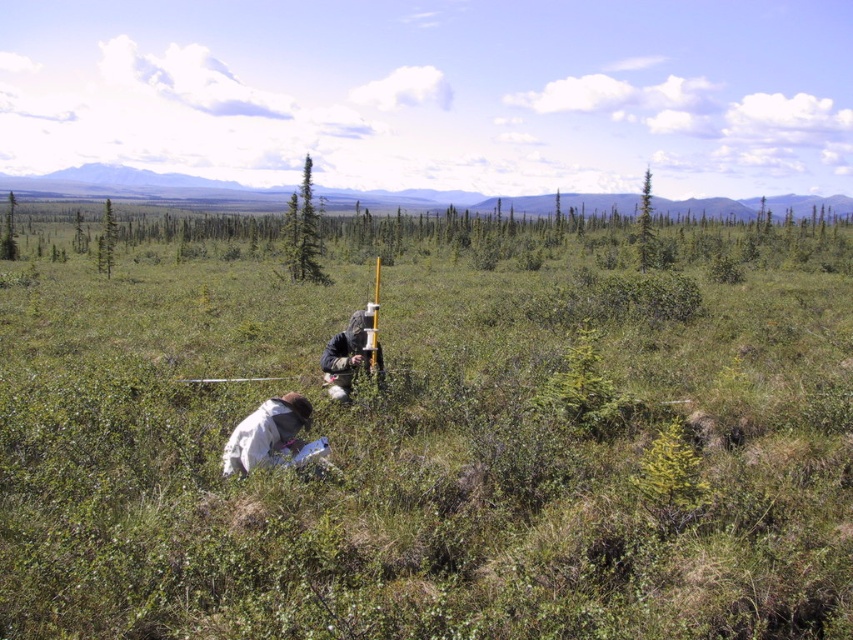
Question: Can you confirm if green grass at center is smaller than green matte tree at center?

Choices:
 (A) yes
 (B) no

Answer: (B)

Question: Which point is closer to the camera taking this photo?

Choices:
 (A) (648, 172)
 (B) (277, 410)
 (C) (111, 212)
 (D) (384, 445)

Answer: (B)

Question: From the image, what is the correct spatial relationship of white fabric at lower left in relation to green matte tree at center?

Choices:
 (A) above
 (B) below

Answer: (B)

Question: Can you confirm if white fabric at center is smaller than green coniferous tree at upper left?

Choices:
 (A) no
 (B) yes

Answer: (B)

Question: Which object is the farthest from the white fabric at center?

Choices:
 (A) green matte tree at center
 (B) green textured tree at upper right
 (C) green coniferous tree at upper left
 (D) green grass at center

Answer: (B)

Question: Which object is the closest to the white fabric at lower left?

Choices:
 (A) green matte tree at center
 (B) green coniferous tree at upper left
 (C) green textured tree at upper right
 (D) green grass at center

Answer: (D)